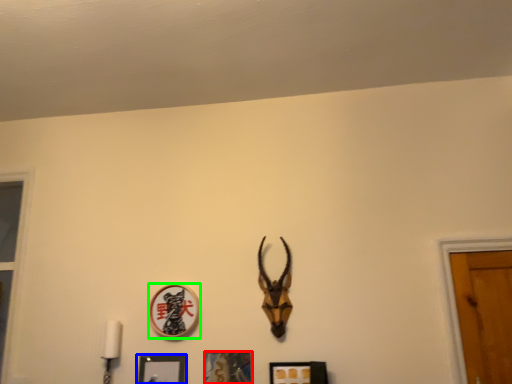
Question: Which object is the closest to the picture frame (highlighted by a red box)? Choose among these: picture frame (highlighted by a blue box) or picture frame (highlighted by a green box).

Choices:
 (A) picture frame
 (B) picture frame

Answer: (A)